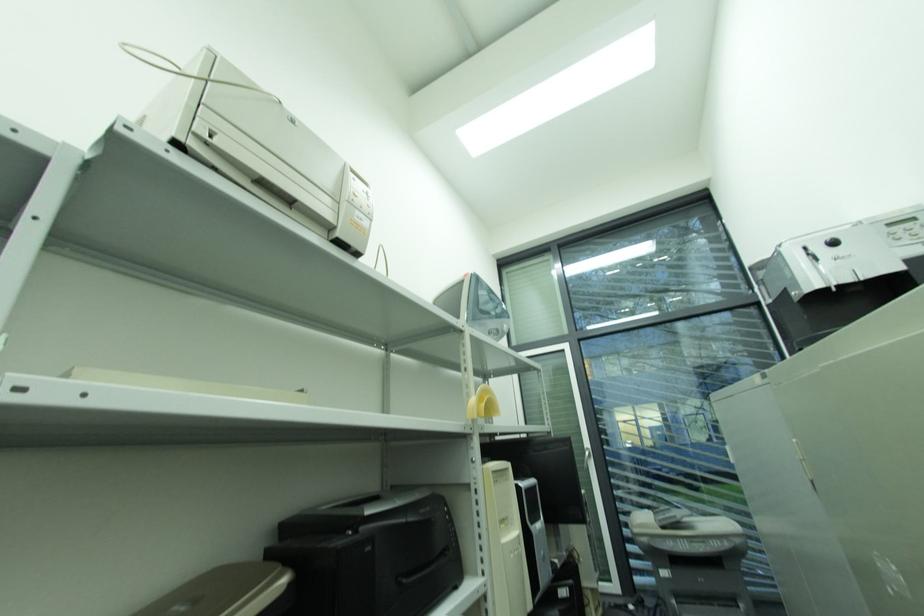
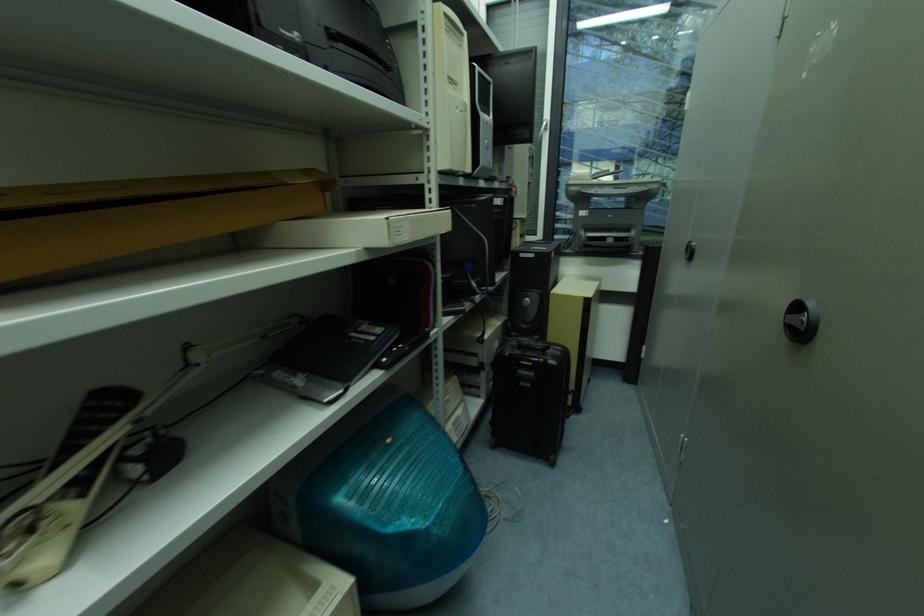
Question: The images are taken continuously from a first-person perspective. In which direction is your viewpoint rotating?

Choices:
 (A) Left
 (B) Right
 (C) Up
 (D) Down

Answer: (D)